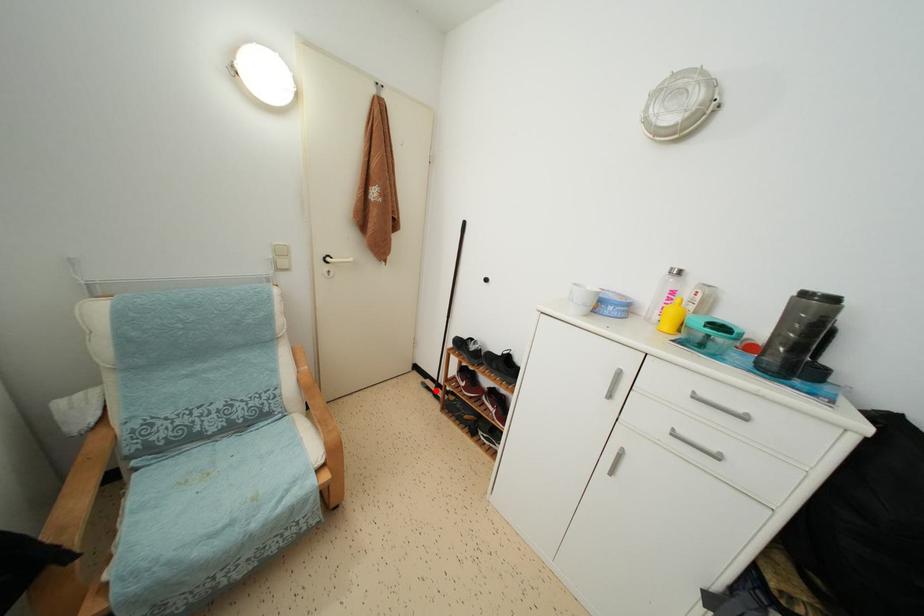
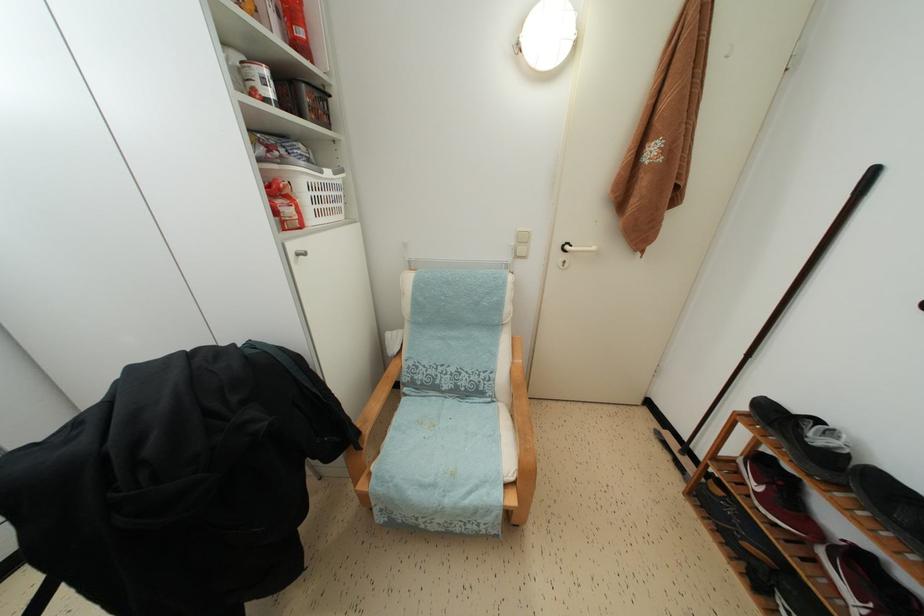
Find the pixel in the second image that matches the highlighted location in the first image.

(678, 450)